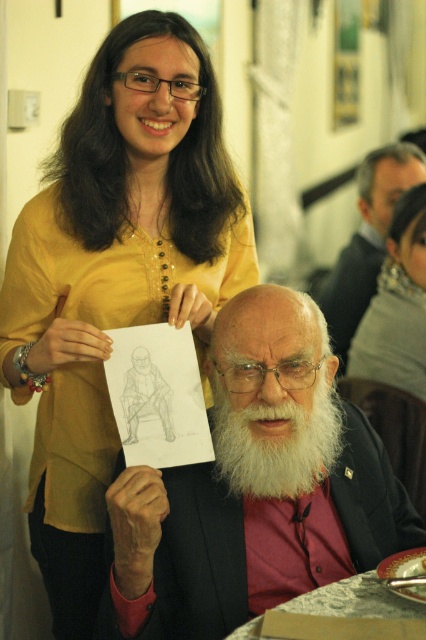
Question: Can you confirm if white fluffy beard at center is smaller than silver metallic table at lower center?

Choices:
 (A) no
 (B) yes

Answer: (A)

Question: Is white beard at center positioned in front of silver metallic table at lower center?

Choices:
 (A) no
 (B) yes

Answer: (A)

Question: Can you confirm if white beard at center is positioned below silver metallic table at lower center?

Choices:
 (A) yes
 (B) no

Answer: (B)

Question: Which object appears farthest from the camera in this image?

Choices:
 (A) white fluffy beard at center
 (B) yellow fabric shirt at upper left
 (C) gray hair at upper center
 (D) silver metallic table at lower center

Answer: (C)

Question: Which of the following is the closest to the observer?

Choices:
 (A) white fluffy beard at center
 (B) gray hair at upper center

Answer: (A)

Question: Which object is positioned closest to the white beard at center?

Choices:
 (A) white fluffy beard at center
 (B) silver metallic table at lower center
 (C) yellow fabric shirt at upper left

Answer: (A)